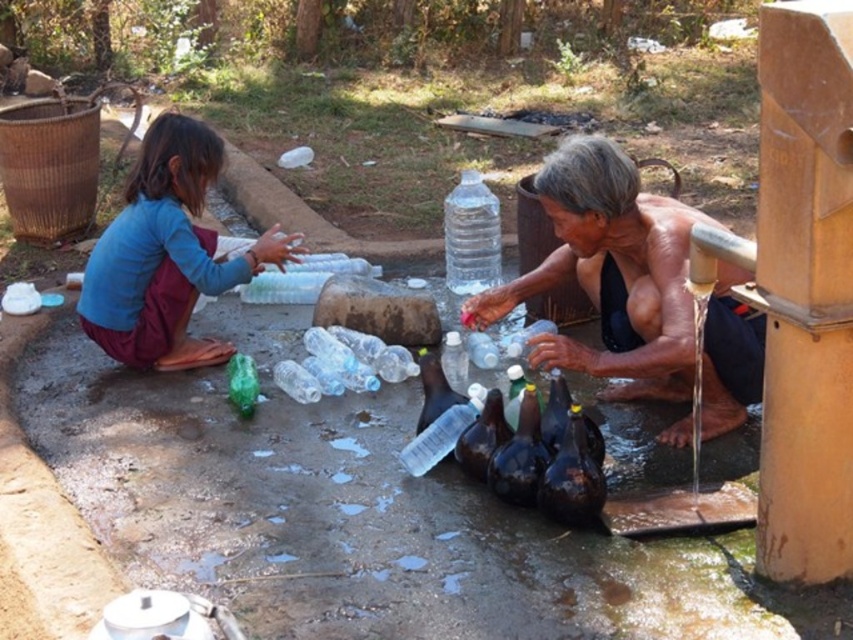
You are standing at the edge of the basin and need to retrieve the translucent plastic bottle at center. Which direction should you move to reach it without stepping on the blue fabric pants at left?

The blue fabric pants at left is to the left of the translucent plastic bottle at center, so you should move to the right to reach the translucent plastic bottle at center without stepping on the blue fabric pants at left.

You are a visitor in this area and need to locate the blue fabric pants at left. According to the coordinates provided, where exactly would you find them in the image?

The blue fabric pants at left are located at the coordinates point [166,253].